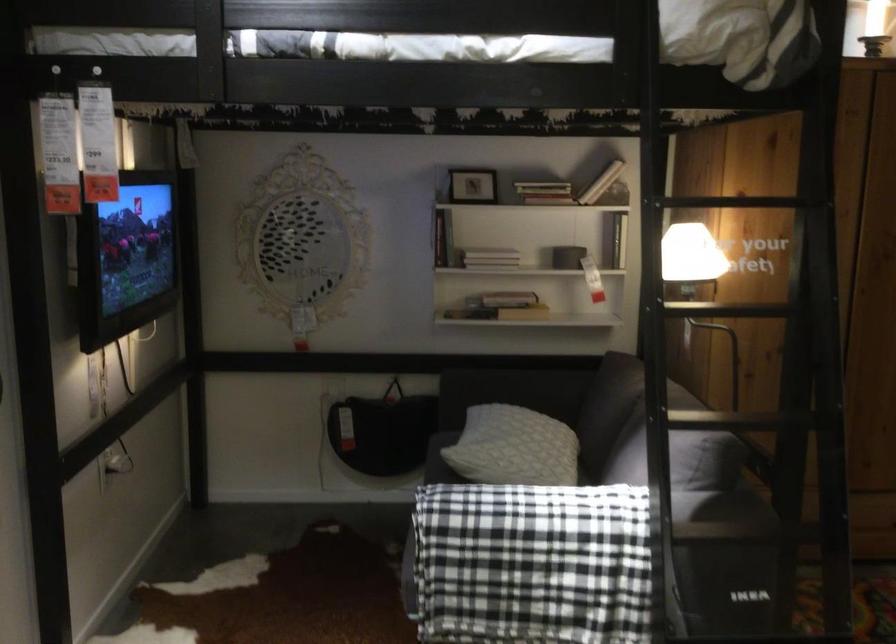
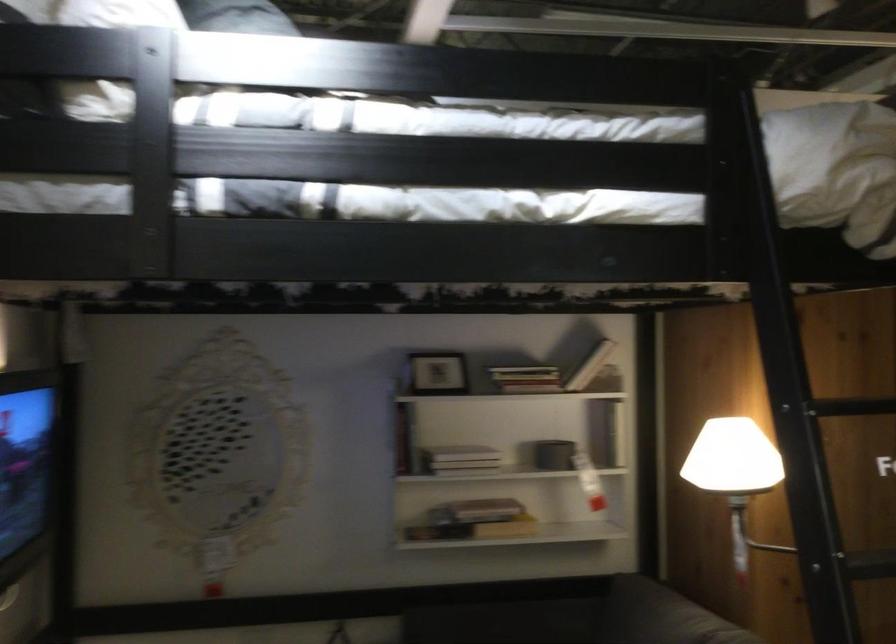
Locate, in the second image, the point that corresponds to (714,80) in the first image.

(831, 261)